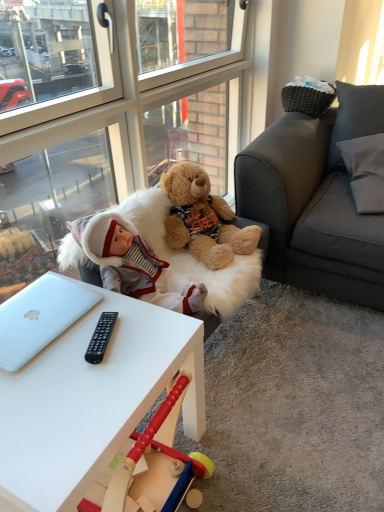
Question: From a real-world perspective, is silver metallic laptop at lower left positioned over white fur swivel chair at center based on gravity?

Choices:
 (A) no
 (B) yes

Answer: (A)

Question: Could white fur swivel chair at center be considered to be inside silver metallic laptop at lower left?

Choices:
 (A) yes
 (B) no

Answer: (B)

Question: Is silver metallic laptop at lower left positioned far away from white fur swivel chair at center?

Choices:
 (A) no
 (B) yes

Answer: (A)

Question: Does silver metallic laptop at lower left appear on the left side of white fur swivel chair at center?

Choices:
 (A) yes
 (B) no

Answer: (A)

Question: Is white fur swivel chair at center at the back of silver metallic laptop at lower left?

Choices:
 (A) yes
 (B) no

Answer: (B)

Question: Is silver metallic laptop at lower left at the right side of white fur swivel chair at center?

Choices:
 (A) no
 (B) yes

Answer: (A)

Question: Is there a large distance between transparent glass door at upper left and white matte desk at center?

Choices:
 (A) yes
 (B) no

Answer: (B)

Question: Can you confirm if transparent glass door at upper left is taller than white matte desk at center?

Choices:
 (A) yes
 (B) no

Answer: (A)

Question: Would you say transparent glass door at upper left contains white matte desk at center?

Choices:
 (A) yes
 (B) no

Answer: (B)

Question: Is transparent glass door at upper left bigger than white matte desk at center?

Choices:
 (A) yes
 (B) no

Answer: (A)

Question: Is the depth of transparent glass door at upper left greater than that of white matte desk at center?

Choices:
 (A) no
 (B) yes

Answer: (B)

Question: Does transparent glass door at upper left appear on the right side of white matte desk at center?

Choices:
 (A) yes
 (B) no

Answer: (A)

Question: From a real-world perspective, is silver metallic laptop at lower left located higher than white fabric pillow at upper right?

Choices:
 (A) no
 (B) yes

Answer: (A)